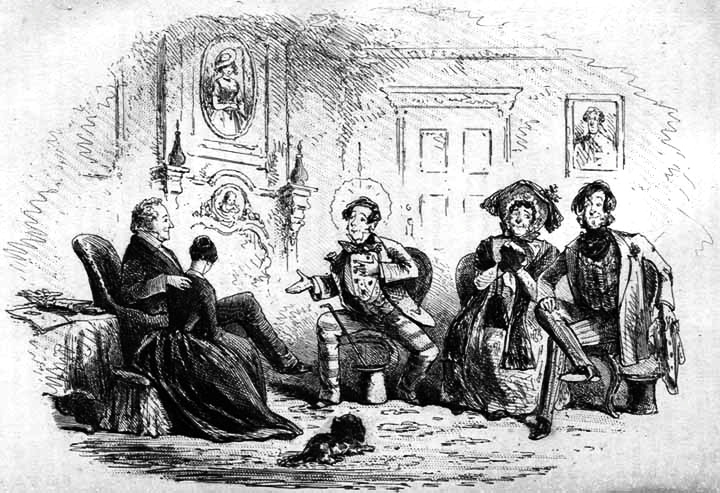
At what (x,y) coordinates should I click in order to perform the action: click on floor. Please return your answer as a coordinate pair (x, y). Looking at the image, I should click on [479, 462], [408, 429], [216, 468].